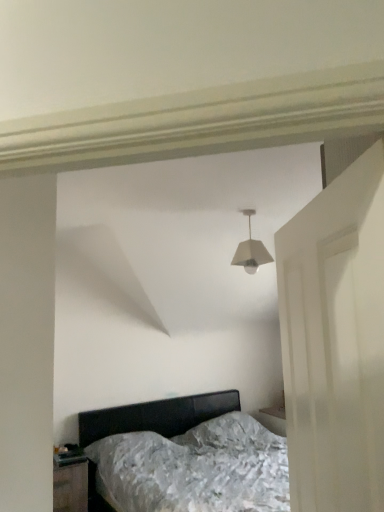
Where is `free spot above white matte lampshade at center (from a real-world perspective)`? This screenshot has width=384, height=512. free spot above white matte lampshade at center (from a real-world perspective) is located at coordinates (243, 205).